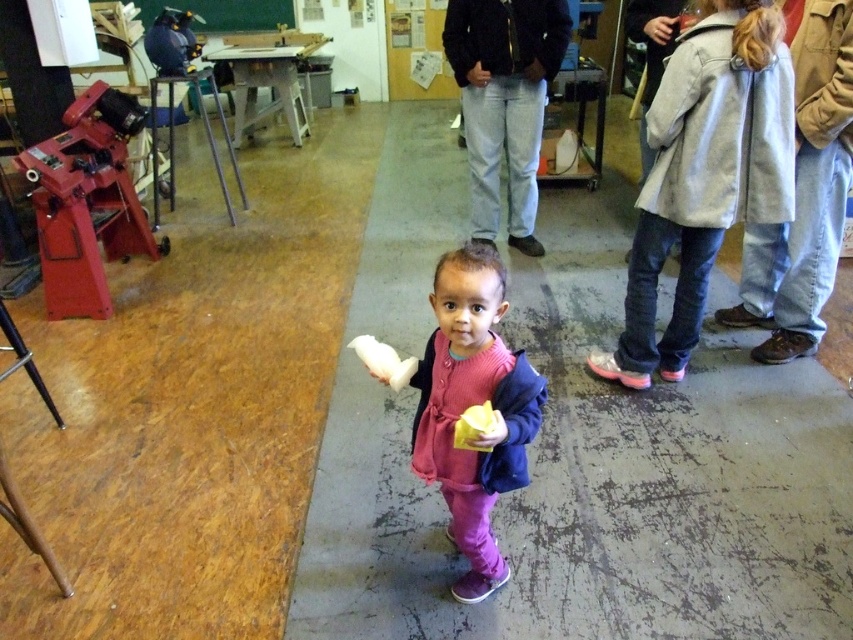
Question: Is light gray wool coat at right positioned behind pink fleece sweater at center?

Choices:
 (A) no
 (B) yes

Answer: (B)

Question: Which of the following is the closest to the observer?

Choices:
 (A) pink fleece sweater at center
 (B) light gray wool coat at right

Answer: (A)

Question: Is light gray wool coat at right bigger than pink fleece sweater at center?

Choices:
 (A) yes
 (B) no

Answer: (A)

Question: Which of the following is the farthest from the observer?

Choices:
 (A) (456, 280)
 (B) (647, 355)

Answer: (B)

Question: Can you confirm if light gray wool coat at right is thinner than pink fleece sweater at center?

Choices:
 (A) yes
 (B) no

Answer: (B)